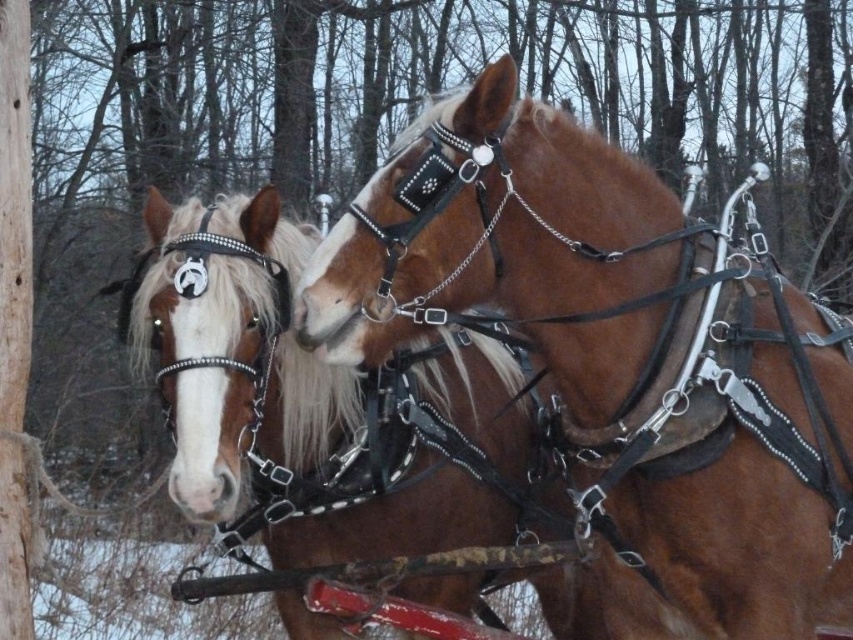
You are standing in front of the two horses and want to know how far the point at coordinates [424,177] is from you. Can you determine the distance?

The point at coordinates [424,177] is 3.78 meters away from you.

Based on the scene description, where is the brown leather harness at center located in terms of its 2D coordinates?

The brown leather harness at center is located at the 2D coordinates of point (618, 360).